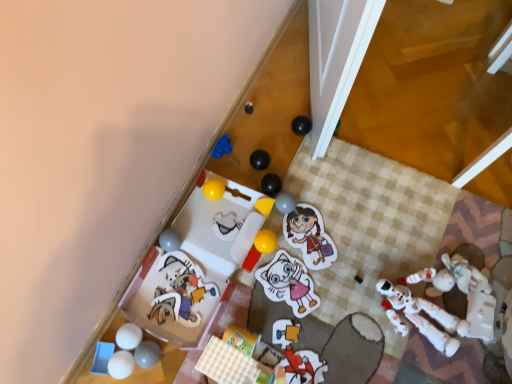
You are a GUI agent. You are given a task and a screenshot of the screen. Output one action in this format:
    pyautogui.click(x=<x>, y=<y>)
    Task: Click on the free space between yellow matte block at upper center, placed as the 11th toy when sorted from left to right, and white rubber ball at lower left, which is the fourteenth toy from right to left
    The image size is (512, 384).
    Given the screenshot: What is the action you would take?
    pyautogui.click(x=204, y=276)